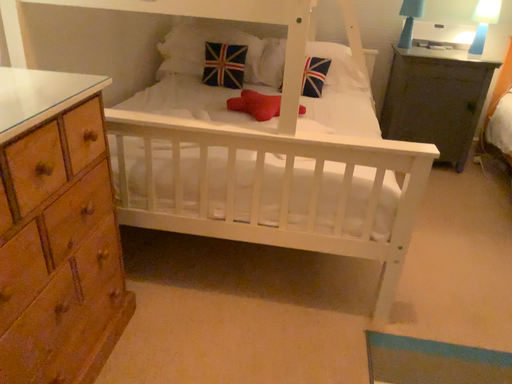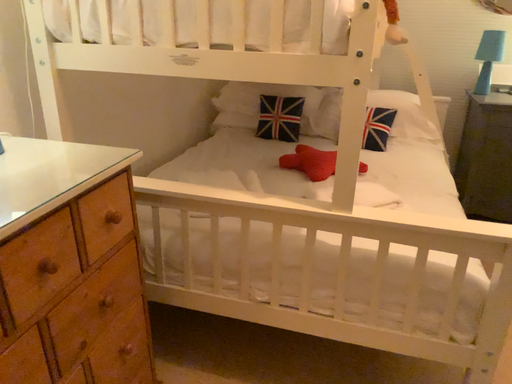
Question: How did the camera likely rotate when shooting the video?

Choices:
 (A) rotated left
 (B) rotated right

Answer: (A)